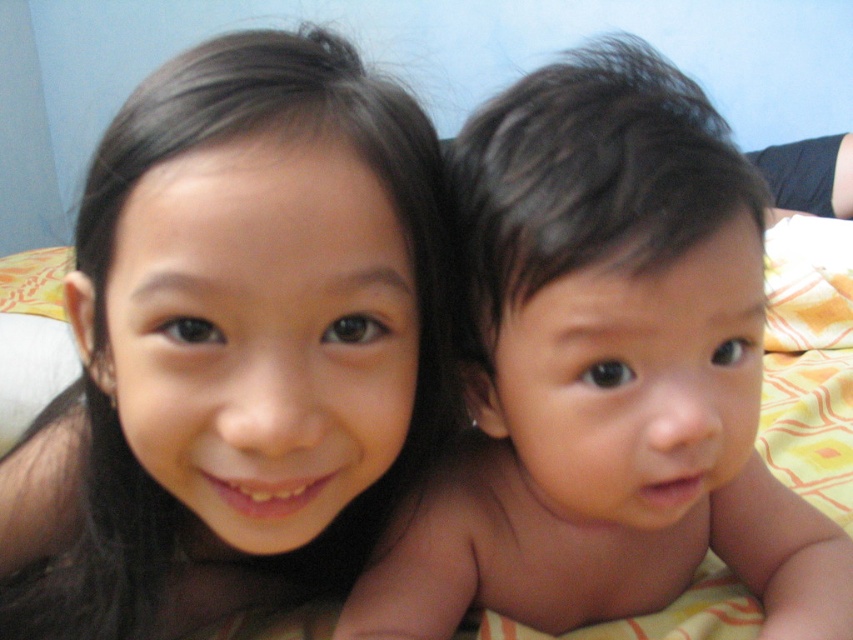
Question: Which of the following is the closest to the observer?

Choices:
 (A) (349, 221)
 (B) (585, 515)

Answer: (A)

Question: Observing the image, what is the correct spatial positioning of smooth skin girl at center in reference to smooth skin baby at center?

Choices:
 (A) below
 (B) above

Answer: (A)

Question: Does smooth skin girl at center come in front of smooth skin baby at center?

Choices:
 (A) no
 (B) yes

Answer: (B)

Question: Among these points, which one is nearest to the camera?

Choices:
 (A) (320, 384)
 (B) (706, 227)

Answer: (A)

Question: Does smooth skin girl at center appear over smooth skin baby at center?

Choices:
 (A) yes
 (B) no

Answer: (B)